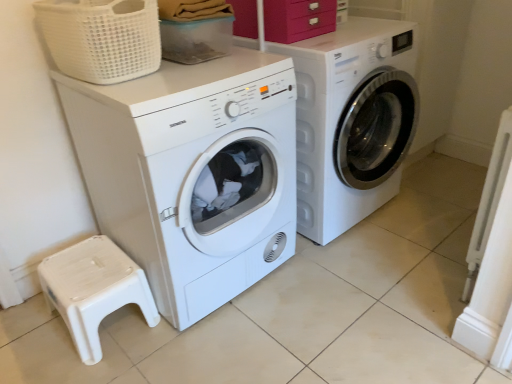
Question: Is white matte washing machine at left, which ranks as the first washing machine in left-to-right order, oriented towards white plastic step stool at lower left?

Choices:
 (A) yes
 (B) no

Answer: (B)

Question: Is white matte washing machine at left, which ranks as the first washing machine in left-to-right order, at the left side of white plastic step stool at lower left?

Choices:
 (A) yes
 (B) no

Answer: (B)

Question: Does white matte washing machine at left, the 2th washing machine positioned from the right, have a smaller size compared to white plastic step stool at lower left?

Choices:
 (A) no
 (B) yes

Answer: (A)

Question: Considering the relative sizes of white matte washing machine at left, the 2th washing machine positioned from the right, and white plastic step stool at lower left in the image provided, is white matte washing machine at left, the 2th washing machine positioned from the right, taller than white plastic step stool at lower left?

Choices:
 (A) yes
 (B) no

Answer: (A)

Question: Can you confirm if white matte washing machine at left, the 2th washing machine positioned from the right, is thinner than white plastic step stool at lower left?

Choices:
 (A) yes
 (B) no

Answer: (B)

Question: Considering their positions, is translucent plastic container at upper center located in front of or behind matte pink drawer at upper center?

Choices:
 (A) behind
 (B) front

Answer: (B)

Question: From a real-world perspective, is translucent plastic container at upper center above or below matte pink drawer at upper center?

Choices:
 (A) below
 (B) above

Answer: (A)

Question: Does point (166, 39) appear closer or farther from the camera than point (297, 6)?

Choices:
 (A) farther
 (B) closer

Answer: (A)

Question: In terms of width, does translucent plastic container at upper center look wider or thinner when compared to matte pink drawer at upper center?

Choices:
 (A) wide
 (B) thin

Answer: (A)

Question: Looking at their shapes, would you say translucent plastic container at upper center is wider or thinner than white plastic step stool at lower left?

Choices:
 (A) wide
 (B) thin

Answer: (B)

Question: Considering the positions of translucent plastic container at upper center and white plastic step stool at lower left in the image, is translucent plastic container at upper center taller or shorter than white plastic step stool at lower left?

Choices:
 (A) short
 (B) tall

Answer: (A)

Question: Is point (185, 28) positioned closer to the camera than point (77, 286)?

Choices:
 (A) closer
 (B) farther

Answer: (B)

Question: Looking at the image, does translucent plastic container at upper center seem bigger or smaller compared to white plastic step stool at lower left?

Choices:
 (A) big
 (B) small

Answer: (B)

Question: Is matte pink drawer at upper center in front of or behind white woven basket at upper left in the image?

Choices:
 (A) behind
 (B) front

Answer: (A)

Question: Is matte pink drawer at upper center wider or thinner than white woven basket at upper left?

Choices:
 (A) thin
 (B) wide

Answer: (A)